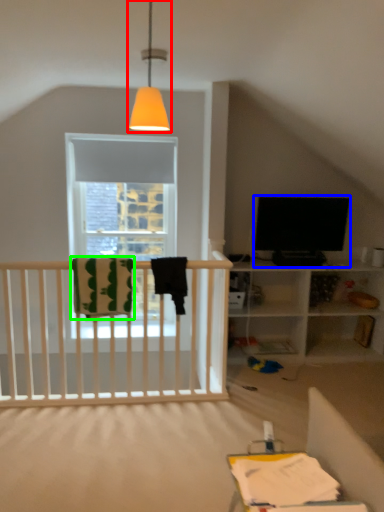
Question: Which is farther away from lamp (highlighted by a red box)? television (highlighted by a blue box) or blanket (highlighted by a green box)?

Choices:
 (A) television
 (B) blanket

Answer: (A)